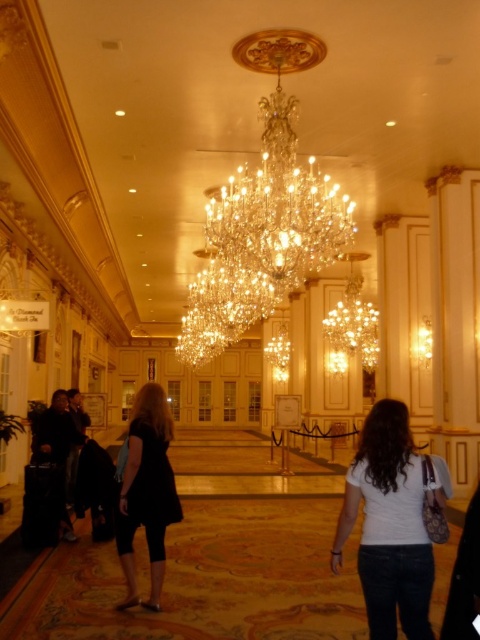
Question: Is white matte shirt at lower right positioned at the back of black matte dress at center?

Choices:
 (A) no
 (B) yes

Answer: (A)

Question: Which of the following is the closest to the observer?

Choices:
 (A) (392, 413)
 (B) (160, 465)

Answer: (A)

Question: Can you confirm if white matte shirt at lower right is smaller than black matte dress at center?

Choices:
 (A) yes
 (B) no

Answer: (A)

Question: Among these objects, which one is nearest to the camera?

Choices:
 (A) black matte dress at center
 (B) white matte shirt at lower right

Answer: (B)

Question: Is the position of white matte shirt at lower right less distant than that of black matte dress at center?

Choices:
 (A) yes
 (B) no

Answer: (A)

Question: Which point is closer to the camera?

Choices:
 (A) white matte shirt at lower right
 (B) black matte dress at center

Answer: (A)